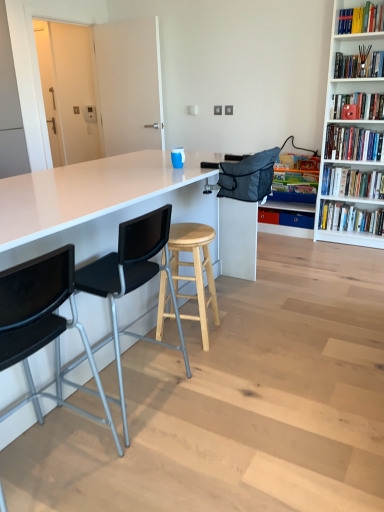
Question: Considering the relative positions of white glossy table at center and wooden bookshelf at upper right, acting as the sixth book starting from the bottom, in the image provided, is white glossy table at center to the right of wooden bookshelf at upper right, acting as the sixth book starting from the bottom, from the viewer's perspective?

Choices:
 (A) yes
 (B) no

Answer: (B)

Question: Considering the relative sizes of white glossy table at center and wooden bookshelf at upper right, placed as the second book when sorted from top to bottom, in the image provided, is white glossy table at center shorter than wooden bookshelf at upper right, placed as the second book when sorted from top to bottom,?

Choices:
 (A) yes
 (B) no

Answer: (B)

Question: Does white glossy table at center have a smaller size compared to wooden bookshelf at upper right, acting as the sixth book starting from the bottom?

Choices:
 (A) no
 (B) yes

Answer: (A)

Question: From the image's perspective, is white glossy table at center below wooden bookshelf at upper right, placed as the second book when sorted from top to bottom?

Choices:
 (A) yes
 (B) no

Answer: (A)

Question: From the image's perspective, is white glossy table at center located above wooden bookshelf at upper right, placed as the second book when sorted from top to bottom?

Choices:
 (A) yes
 (B) no

Answer: (B)

Question: Can you see white glossy table at center touching wooden bookshelf at upper right, acting as the sixth book starting from the bottom?

Choices:
 (A) no
 (B) yes

Answer: (A)

Question: Considering the relative sizes of natural wood stool at center and wooden bookshelf at upper right, acting as the sixth book starting from the bottom, in the image provided, is natural wood stool at center wider than wooden bookshelf at upper right, acting as the sixth book starting from the bottom,?

Choices:
 (A) yes
 (B) no

Answer: (A)

Question: Can you see natural wood stool at center touching wooden bookshelf at upper right, acting as the sixth book starting from the bottom?

Choices:
 (A) no
 (B) yes

Answer: (A)

Question: Is natural wood stool at center aimed at wooden bookshelf at upper right, placed as the second book when sorted from top to bottom?

Choices:
 (A) yes
 (B) no

Answer: (B)

Question: Is natural wood stool at center at the left side of wooden bookshelf at upper right, placed as the second book when sorted from top to bottom?

Choices:
 (A) no
 (B) yes

Answer: (B)

Question: Is natural wood stool at center not inside wooden bookshelf at upper right, acting as the sixth book starting from the bottom?

Choices:
 (A) no
 (B) yes

Answer: (B)

Question: Can you confirm if natural wood stool at center is shorter than wooden bookshelf at upper right, acting as the sixth book starting from the bottom?

Choices:
 (A) no
 (B) yes

Answer: (A)

Question: Is blue plastic drawer at center behind matte red bookshelf at upper right, the 5th book when ordered from bottom to top?

Choices:
 (A) yes
 (B) no

Answer: (A)